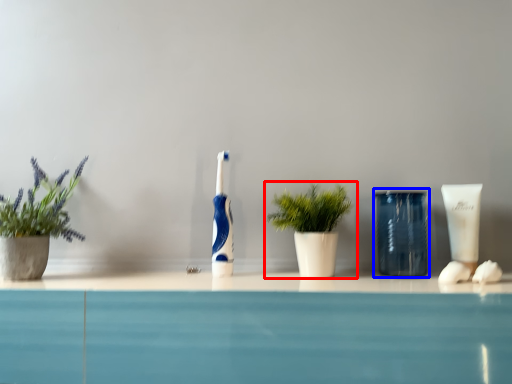
Question: Which point is closer to the camera, houseplant (highlighted by a red box) or glass vase (highlighted by a blue box)?

Choices:
 (A) houseplant
 (B) glass vase

Answer: (A)